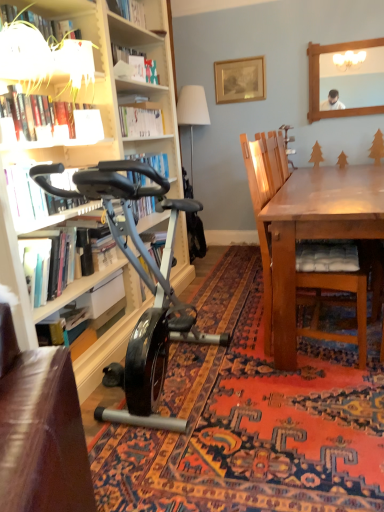
Question: Is gold-framed picture at upper center not close to white paper at upper center, placed as the 2th shelf when sorted from front to back?

Choices:
 (A) no
 (B) yes

Answer: (B)

Question: From a real-world perspective, is gold-framed picture at upper center below white paper at upper center, placed as the 2th shelf when sorted from front to back?

Choices:
 (A) yes
 (B) no

Answer: (A)

Question: Does gold-framed picture at upper center have a smaller size compared to white paper at upper center, which appears as the 2th shelf when ordered from the bottom?

Choices:
 (A) no
 (B) yes

Answer: (A)

Question: From a real-world perspective, is gold-framed picture at upper center over white paper at upper center, which is counted as the 1th shelf, starting from the top?

Choices:
 (A) no
 (B) yes

Answer: (A)

Question: Is gold-framed picture at upper center shorter than white paper at upper center, which is counted as the first shelf, starting from the right?

Choices:
 (A) yes
 (B) no

Answer: (B)

Question: From a real-world perspective, is shiny black exercise bike at left positioned above or below hardcover book at upper left, acting as the fourth book starting from the bottom?

Choices:
 (A) below
 (B) above

Answer: (A)

Question: Considering the positions of shiny black exercise bike at left and hardcover book at upper left, acting as the fourth book starting from the bottom, in the image, is shiny black exercise bike at left bigger or smaller than hardcover book at upper left, acting as the fourth book starting from the bottom,?

Choices:
 (A) big
 (B) small

Answer: (A)

Question: Would you say shiny black exercise bike at left is inside or outside hardcover book at upper left, acting as the fourth book starting from the bottom?

Choices:
 (A) inside
 (B) outside

Answer: (B)

Question: From the image's perspective, is shiny black exercise bike at left located above or below hardcover book at upper left, acting as the fourth book starting from the bottom?

Choices:
 (A) below
 (B) above

Answer: (A)

Question: Visually, is hardcover book at left, the 3th book from the top, positioned to the left or to the right of white glossy lampshade at upper left, which is counted as the first shelf, starting from the bottom?

Choices:
 (A) left
 (B) right

Answer: (A)

Question: In the image, is hardcover book at left, the 3th book from the top, positioned in front of or behind white glossy lampshade at upper left, which is counted as the second shelf, starting from the right?

Choices:
 (A) behind
 (B) front

Answer: (A)

Question: In terms of size, does hardcover book at left, the 3th book from the top, appear bigger or smaller than white glossy lampshade at upper left, which is counted as the second shelf, starting from the right?

Choices:
 (A) big
 (B) small

Answer: (A)

Question: Considering the positions of point (43, 313) and point (39, 40), is point (43, 313) closer or farther from the camera than point (39, 40)?

Choices:
 (A) closer
 (B) farther

Answer: (B)

Question: From the image's perspective, is hardcover book at left, the 3th book from the top, positioned above or below shiny black exercise bike at left?

Choices:
 (A) below
 (B) above

Answer: (B)

Question: Is hardcover book at left, the second book positioned from the bottom, taller or shorter than shiny black exercise bike at left?

Choices:
 (A) short
 (B) tall

Answer: (A)